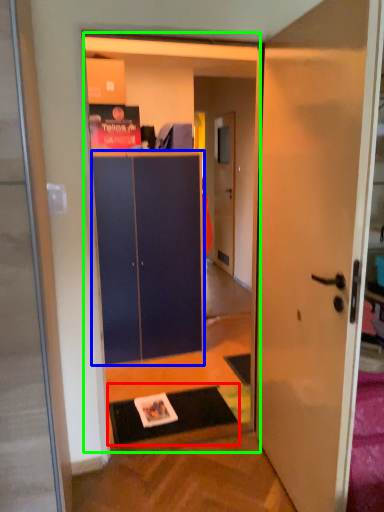
Question: Which is nearer to the doormat (highlighted by a red box)? cabinetry (highlighted by a blue box) or bookstore (highlighted by a green box).

Choices:
 (A) cabinetry
 (B) bookstore

Answer: (A)